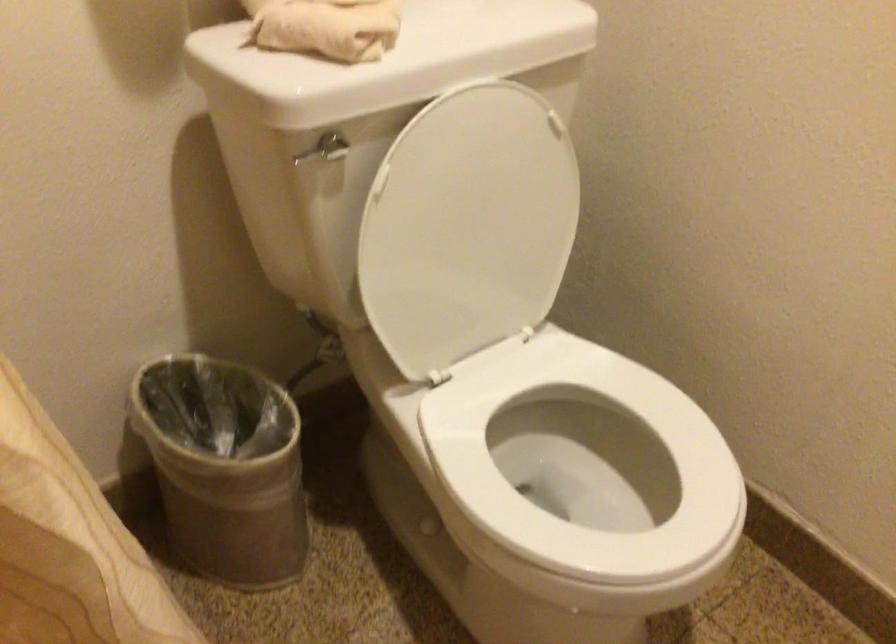
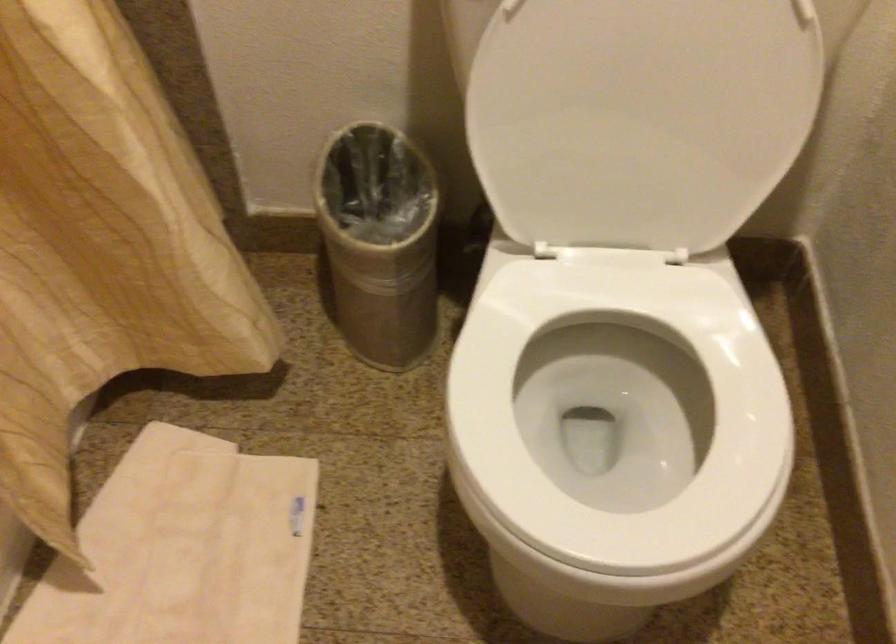
Find the pixel in the second image that matches [478,240] in the first image.

(640, 118)